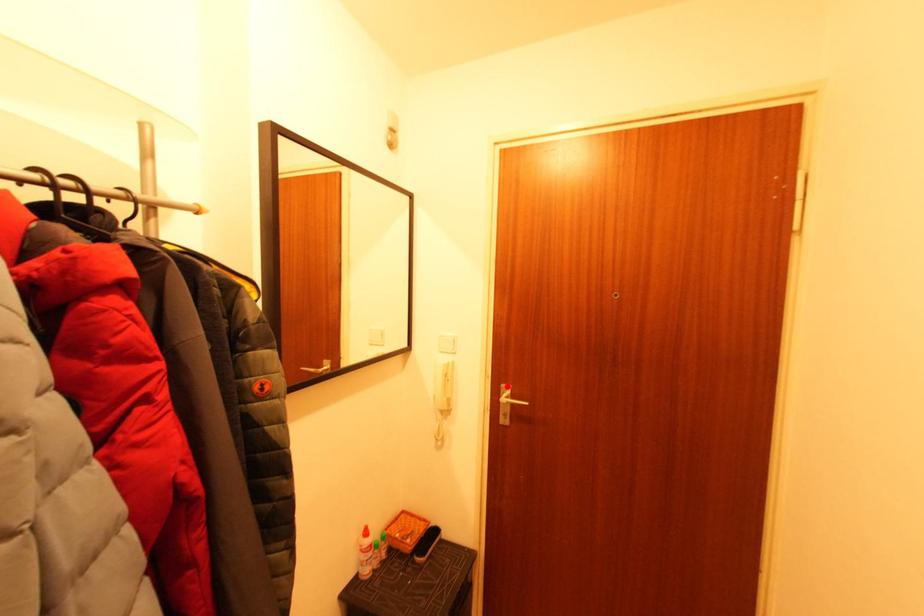
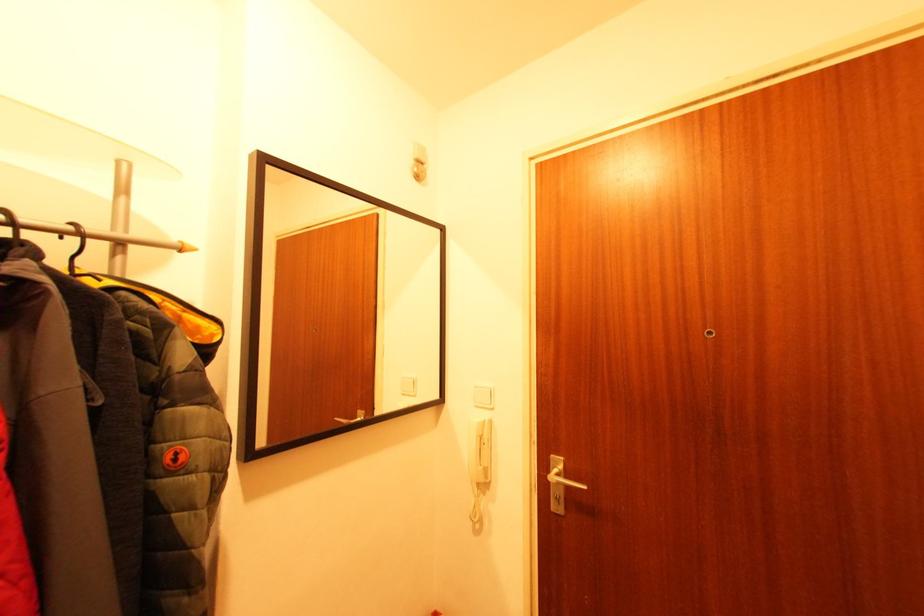
Locate, in the second image, the point that corresponds to the highlighted location in the first image.

(556, 456)